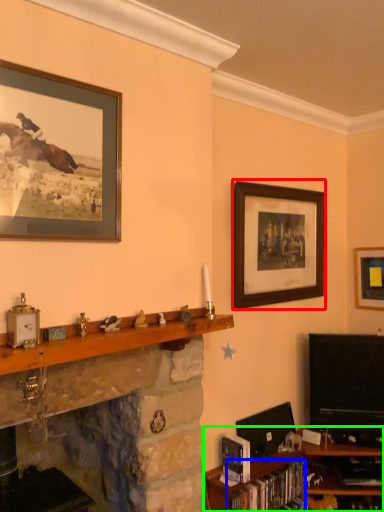
Question: Which object is positioned farthest from picture frame (highlighted by a red box)? Select from book (highlighted by a blue box) and shelf (highlighted by a green box).

Choices:
 (A) book
 (B) shelf

Answer: (A)